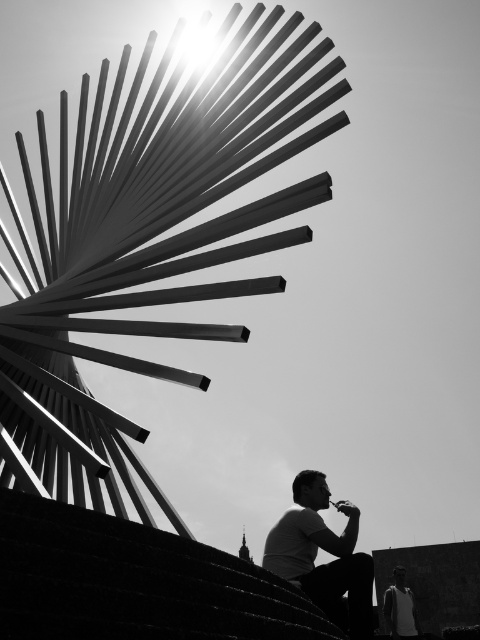
Where is `white matte shirt at lower right`? white matte shirt at lower right is located at coordinates (325, 563).

Does white matte shirt at lower right have a greater width compared to transparent plastic cup at lower right?

Yes, white matte shirt at lower right is wider than transparent plastic cup at lower right.

This screenshot has height=640, width=480. Describe the element at coordinates (325, 563) in the screenshot. I see `white matte shirt at lower right` at that location.

This screenshot has width=480, height=640. I want to click on white matte shirt at lower right, so click(325, 563).

Which is above, white matte shirt at lower right or white matte tank top at lower right?

white matte shirt at lower right

Who is lower down, white matte shirt at lower right or white matte tank top at lower right?

white matte tank top at lower right

Locate an element on the screen. This screenshot has width=480, height=640. white matte shirt at lower right is located at coordinates (325, 563).

Who is higher up, white matte tank top at lower right or transparent plastic cup at lower right?

transparent plastic cup at lower right

Is white matte tank top at lower right to the right of transparent plastic cup at lower right from the viewer's perspective?

Yes, white matte tank top at lower right is to the right of transparent plastic cup at lower right.

Where is `white matte tank top at lower right`? This screenshot has height=640, width=480. white matte tank top at lower right is located at coordinates (400, 609).